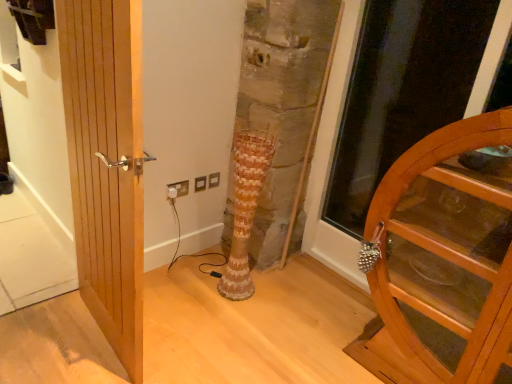
You are a GUI agent. You are given a task and a screenshot of the screen. Output one action in this format:
    pyautogui.click(x=<x>, y=<y>)
    Task: Click on the vacant space situated on the left part of natural wood door at left, the second door when ordered from right to left
    The height and width of the screenshot is (384, 512).
    Given the screenshot: What is the action you would take?
    pyautogui.click(x=56, y=333)